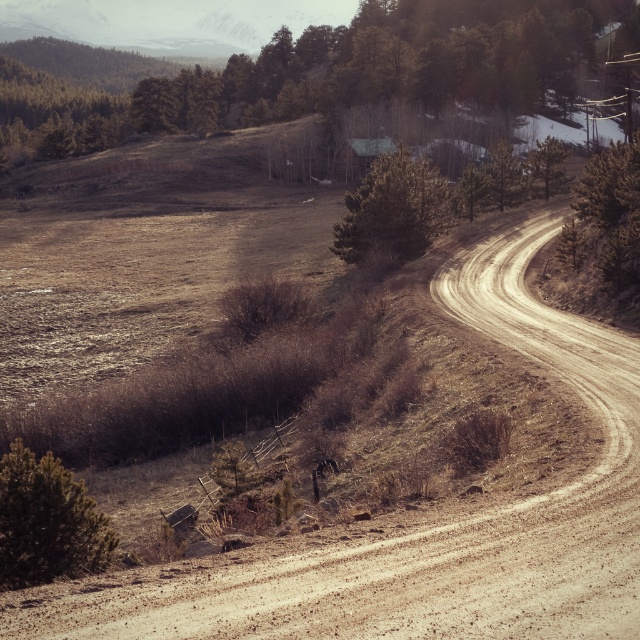
You are navigating a drone over a rural landscape with a winding dirt road. You need to locate the green matte tree at upper center. According to the coordinates provided, where should you direct the drone to find it?

The green matte tree at upper center is located at point (317,74), so direct the drone to that coordinate to find it.